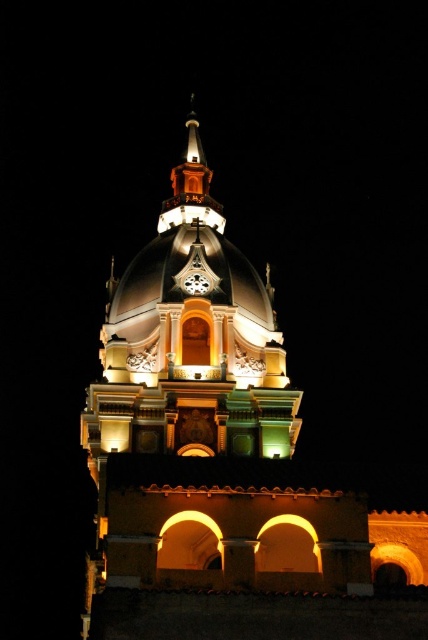
Does polished brass spire at upper center appear over white glossy clock at center?

Correct, polished brass spire at upper center is located above white glossy clock at center.

Does polished brass spire at upper center appear on the left side of white glossy clock at center?

Correct, you'll find polished brass spire at upper center to the left of white glossy clock at center.

Is point (166, 218) positioned in front of point (208, 276)?

No, (166, 218) is further to viewer.

Where is `polished brass spire at upper center`? polished brass spire at upper center is located at coordinates pos(190,186).

Is polished gold dome at center behind white glossy clock at center?

No, polished gold dome at center is in front of white glossy clock at center.

From the picture: Between polished gold dome at center and white glossy clock at center, which one is positioned higher?

white glossy clock at center is higher up.

Between point (204, 396) and point (199, 282), which one is positioned behind?

Point (199, 282)

The width and height of the screenshot is (428, 640). I want to click on polished gold dome at center, so click(x=190, y=340).

Does polished gold dome at center appear over polished brass spire at upper center?

Incorrect, polished gold dome at center is not positioned above polished brass spire at upper center.

Between polished gold dome at center and polished brass spire at upper center, which one has more height?

Standing taller between the two is polished gold dome at center.

Between point (101, 403) and point (187, 192), which one is positioned in front?

Point (101, 403) is in front.

Identify the location of polished gold dome at center. The height and width of the screenshot is (640, 428). (190, 340).